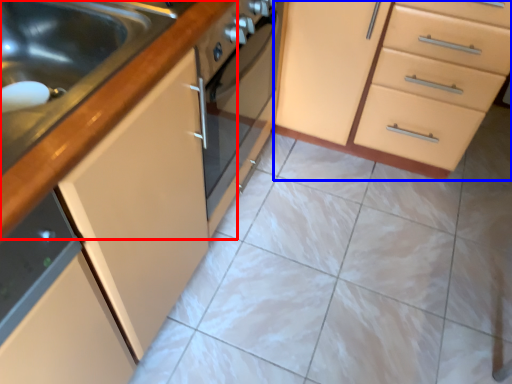
Question: Which object appears closest to the camera in this image, countertop (highlighted by a red box) or cabinetry (highlighted by a blue box)?

Choices:
 (A) countertop
 (B) cabinetry

Answer: (A)